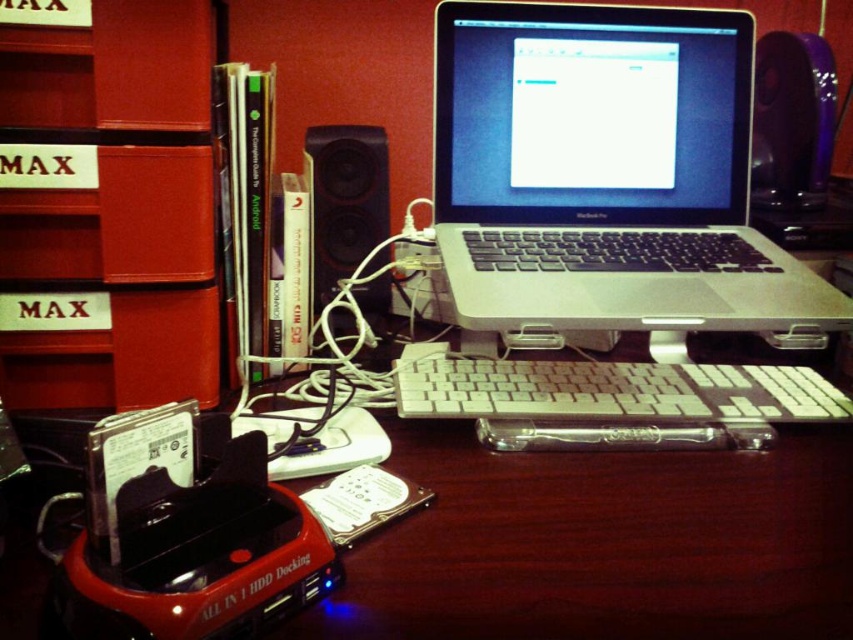
Question: Which of the following is the farthest from the observer?

Choices:
 (A) (688, 156)
 (B) (126, 371)
 (C) (529, 416)

Answer: (A)

Question: Among these objects, which one is nearest to the camera?

Choices:
 (A) purple glossy speaker at upper right
 (B) red wood bookshelf at upper left
 (C) black plastic speaker at center
 (D) white plastic keyboard at center

Answer: (B)

Question: Where is purple glossy speaker at upper right located in relation to black plastic speaker at center in the image?

Choices:
 (A) right
 (B) left

Answer: (A)

Question: Does silver/black plastic laptop at center come behind white plastic keyboard at center?

Choices:
 (A) yes
 (B) no

Answer: (B)

Question: Does silver/black plastic laptop at center appear over black plastic speaker at center?

Choices:
 (A) yes
 (B) no

Answer: (B)

Question: Which of these objects is positioned farthest from the red wood bookshelf at upper left?

Choices:
 (A) purple glossy speaker at upper right
 (B) silver/black plastic laptop at center
 (C) white plastic keyboard at center

Answer: (A)